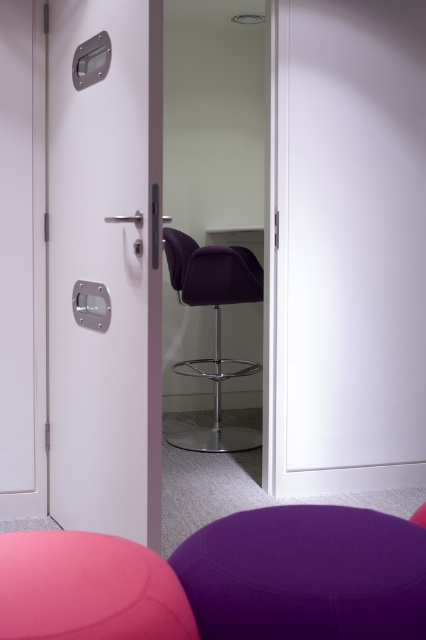
Question: Does white glossy door at left appear under purple fabric bar stool at lower center?

Choices:
 (A) yes
 (B) no

Answer: (B)

Question: Is white glossy door at left smaller than purple velvet swivel chair at center?

Choices:
 (A) yes
 (B) no

Answer: (B)

Question: Does white glossy door at left appear under purple fabric bar stool at center?

Choices:
 (A) yes
 (B) no

Answer: (B)

Question: Which of the following is the farthest from the observer?

Choices:
 (A) purple fabric bar stool at lower center
 (B) purple velvet swivel chair at center
 (C) white glossy door at left

Answer: (B)

Question: Which point is farther to the camera?

Choices:
 (A) (9, 588)
 (B) (92, 484)
 (C) (215, 394)

Answer: (C)

Question: Which object is closer to the camera taking this photo?

Choices:
 (A) purple fabric bar stool at lower center
 (B) purple fabric bar stool at center
 (C) white glossy door at left
 (D) purple velvet swivel chair at center

Answer: (B)